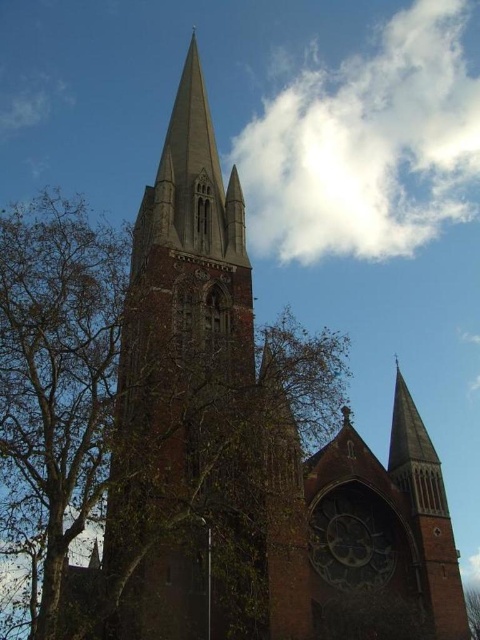
Who is shorter, brown textured tree at left or white fluffy cloud at upper center?

brown textured tree at left is shorter.

Measure the distance from brown textured tree at left to white fluffy cloud at upper center.

brown textured tree at left and white fluffy cloud at upper center are 48.73 meters apart from each other.

You are a GUI agent. You are given a task and a screenshot of the screen. Output one action in this format:
    pyautogui.click(x=<x>, y=<y>)
    Task: Click on the brown textured tree at left
    
    Given the screenshot: What is the action you would take?
    pyautogui.click(x=158, y=429)

Does white fluffy cloud at upper center appear on the left side of dark brown wooden clock at center?

Incorrect, white fluffy cloud at upper center is not on the left side of dark brown wooden clock at center.

Does white fluffy cloud at upper center appear over dark brown wooden clock at center?

Correct, white fluffy cloud at upper center is located above dark brown wooden clock at center.

This screenshot has height=640, width=480. What do you see at coordinates (367, 145) in the screenshot?
I see `white fluffy cloud at upper center` at bounding box center [367, 145].

Identify the location of white fluffy cloud at upper center. This screenshot has height=640, width=480. (367, 145).

Who is more distant from viewer, (59, 404) or (387, 557)?

Positioned behind is point (59, 404).

Does brown textured tree at left have a lesser height compared to dark brown wooden clock at center?

Incorrect, brown textured tree at left's height does not fall short of dark brown wooden clock at center's.

Is point (68, 428) positioned behind point (316, 522)?

No, (68, 428) is in front of (316, 522).

The height and width of the screenshot is (640, 480). Find the location of `brown textured tree at left`. brown textured tree at left is located at coordinates (158, 429).